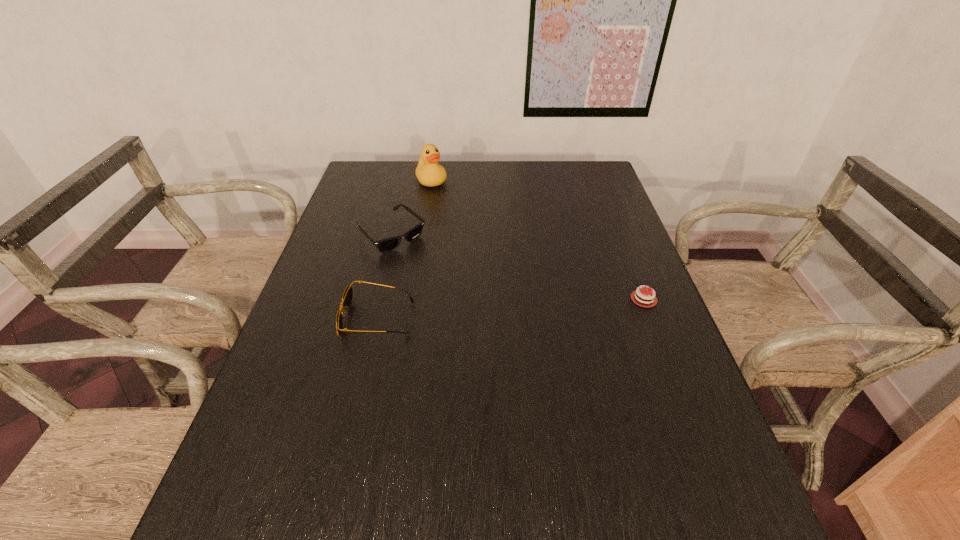
This screenshot has width=960, height=540. Find the location of `vacant area situated 0.340m at the beak of the farthest object`. vacant area situated 0.340m at the beak of the farthest object is located at coordinates (480, 245).

Find the location of `vacant space located at the beak of the farthest object`. vacant space located at the beak of the farthest object is located at coordinates (456, 213).

This screenshot has width=960, height=540. Find the location of `free spot located on the front-facing side of the second farthest object`. free spot located on the front-facing side of the second farthest object is located at coordinates (489, 323).

This screenshot has height=540, width=960. Identify the location of free region located 0.160m on the front-facing side of the second farthest object. (443, 282).

Find the location of a particular element. blank area located on the front-facing side of the second farthest object is located at coordinates (434, 274).

At what (x,y) coordinates should I click in order to perform the action: click on object that is positioned at the far edge. Please return your answer as a coordinate pair (x, y). The height and width of the screenshot is (540, 960). Looking at the image, I should click on (429, 173).

This screenshot has height=540, width=960. What are the coordinates of `object present at the right edge` in the screenshot? It's located at (636, 297).

At what (x,y) coordinates should I click in order to perform the action: click on vacant space at the far edge of the desktop. Please return your answer as a coordinate pair (x, y). Looking at the image, I should click on (500, 176).

The image size is (960, 540). In the image, there is a desktop. What are the coordinates of `vacant space at the near edge` in the screenshot? It's located at (519, 476).

The image size is (960, 540). I want to click on free space at the left edge of the desktop, so click(x=322, y=417).